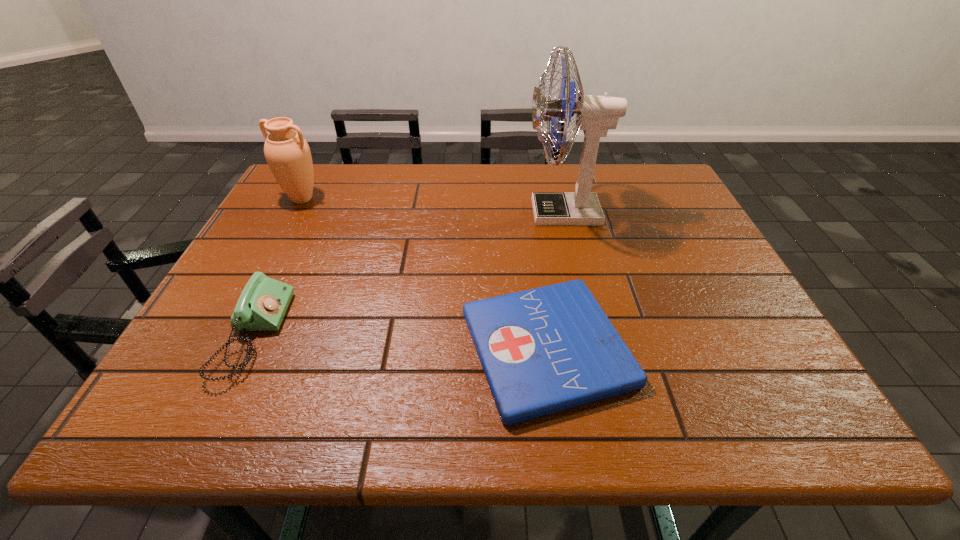
The width and height of the screenshot is (960, 540). I want to click on free space at the left edge of the desktop, so pyautogui.click(x=262, y=232).

Image resolution: width=960 pixels, height=540 pixels. I want to click on free point at the right edge, so click(735, 296).

Image resolution: width=960 pixels, height=540 pixels. Identify the location of free space at the far left corner of the desktop. (319, 193).

Identify the location of blank area at the far right corner. (626, 179).

The height and width of the screenshot is (540, 960). Find the location of `vacant region at the near right corner`. vacant region at the near right corner is located at coordinates (754, 430).

This screenshot has height=540, width=960. I want to click on blank region between the second shortest object and the third shortest object, so click(x=277, y=267).

Where is `unoccupied area between the shortest object and the fan`? unoccupied area between the shortest object and the fan is located at coordinates (556, 280).

Locate an element on the screen. This screenshot has height=540, width=960. vacant region between the second tallest object and the fan is located at coordinates (433, 206).

Identify the location of free space between the first-aid kit and the third tallest object. (400, 341).

Where is `empty space that is in between the first-aid kit and the second shortest object`? The height and width of the screenshot is (540, 960). empty space that is in between the first-aid kit and the second shortest object is located at coordinates (400, 341).